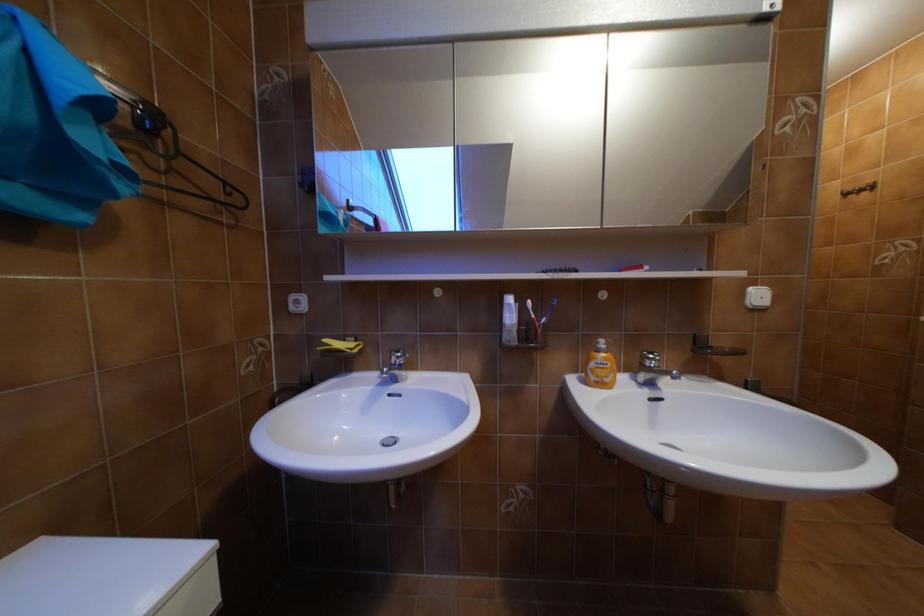
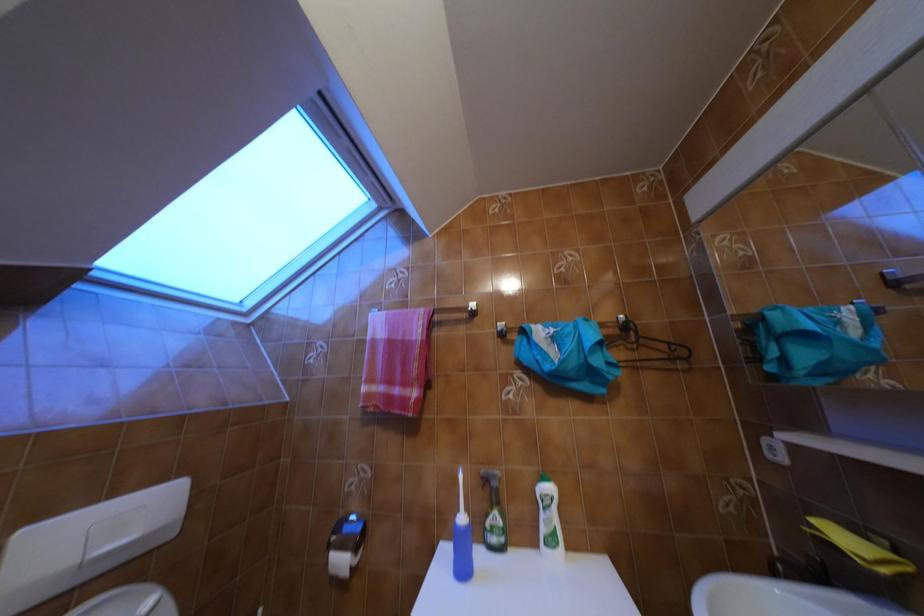
Question: The first image is from the beginning of the video and the second image is from the end. How did the camera likely rotate when shooting the video?

Choices:
 (A) Left
 (B) Right
 (C) Up
 (D) Down

Answer: (A)